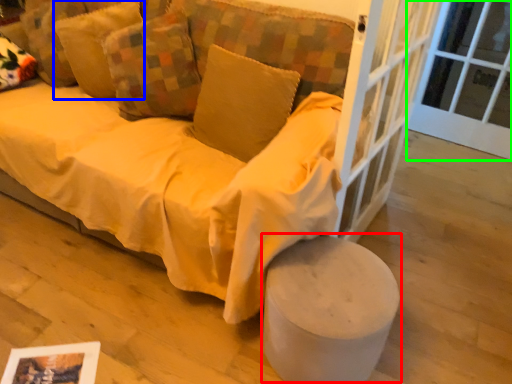
Question: Considering the real-world distances, which object is farthest from stool (highlighted by a red box)? pillow (highlighted by a blue box) or window frame (highlighted by a green box)?

Choices:
 (A) pillow
 (B) window frame

Answer: (B)